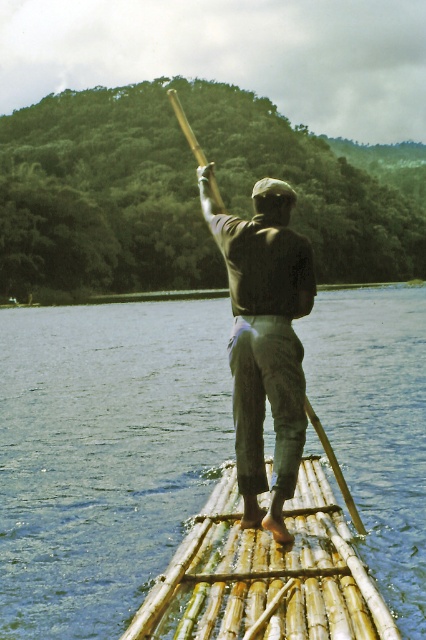
Question: Is blue water at center wider than bamboo raft at center?

Choices:
 (A) no
 (B) yes

Answer: (B)

Question: Among these objects, which one is nearest to the camera?

Choices:
 (A) wooden paddle at center
 (B) bamboo raft at center

Answer: (B)

Question: Estimate the real-world distances between objects in this image. Which object is farther from the blue water at center?

Choices:
 (A) dark brown leather pants at center
 (B) bamboo raft at center
 (C) wooden paddle at center

Answer: (C)

Question: Can you confirm if blue water at center is wider than dark brown leather pants at center?

Choices:
 (A) yes
 (B) no

Answer: (A)

Question: Estimate the real-world distances between objects in this image. Which object is farther from the bamboo raft at center?

Choices:
 (A) wooden paddle at center
 (B) dark brown leather pants at center
 (C) blue water at center

Answer: (C)

Question: Is bamboo raft at center behind dark brown leather pants at center?

Choices:
 (A) yes
 (B) no

Answer: (B)